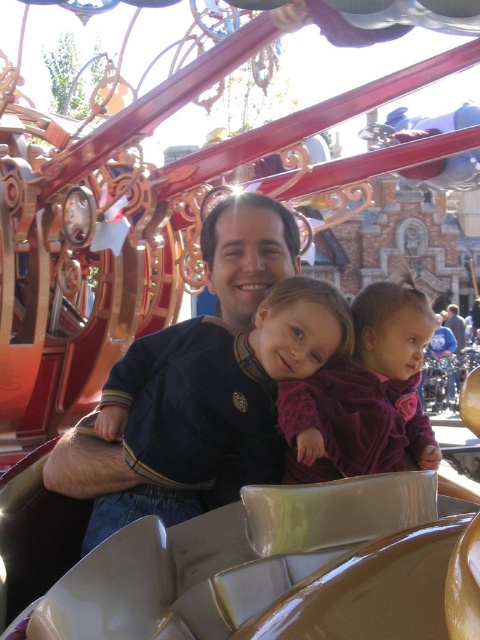
Looking at this image, in the theme park ride scene, there are two people wearing a matte blue shirt at center and a purple velvet dress at center. Which one is located to the left?

The matte blue shirt at center is positioned on the left side of the purple velvet dress at center, so the matte blue shirt at center is the one located to the left.

You are a photographer positioned in front of the ride vehicle. You want to take a photo that includes both the matte blue shirt at center and the purple velvet dress at center. Which one is closer to you?

The matte blue shirt at center is closer to you since it is further to the viewer than the purple velvet dress at center.

You are standing in front of the theme park ride and notice the point at coordinates (206, 380). What object is located at that point?

The matte blue shirt at center is located at point (206, 380).